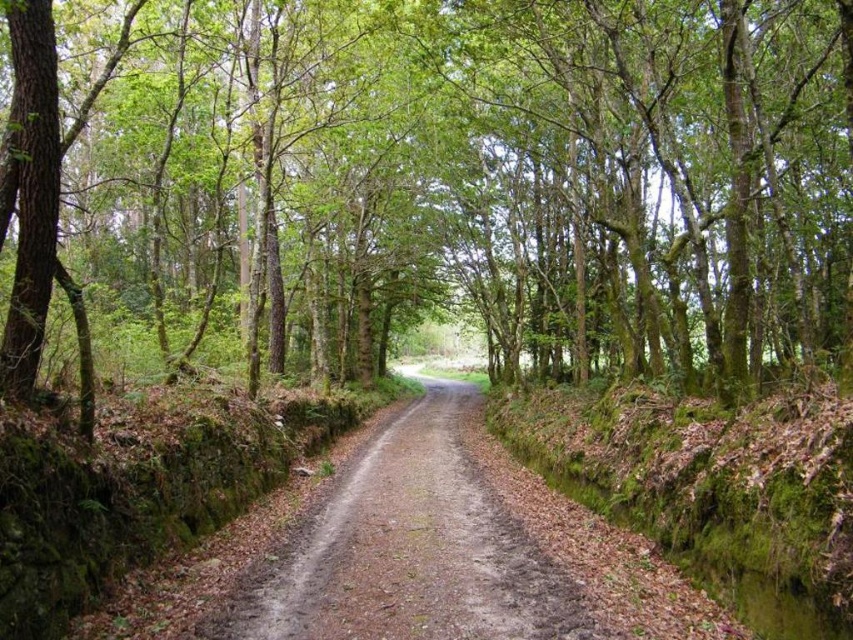
Looking at this image, between green leafy tree at center and dirt/gravel road at center, which one is positioned lower?

Positioned lower is dirt/gravel road at center.

This screenshot has height=640, width=853. What are the coordinates of `green leafy tree at center` in the screenshot? It's located at (447, 179).

Image resolution: width=853 pixels, height=640 pixels. Describe the element at coordinates (447, 179) in the screenshot. I see `green leafy tree at center` at that location.

This screenshot has width=853, height=640. I want to click on green leafy tree at center, so coord(447,179).